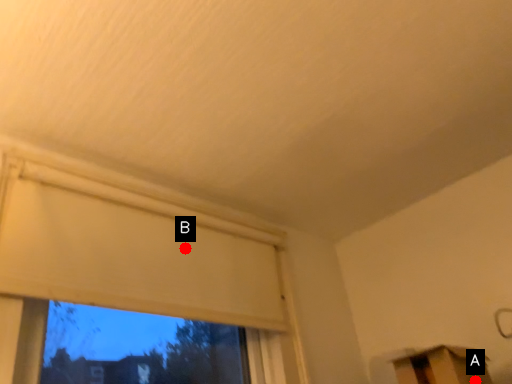
Question: Two points are circled on the image, labeled by A and B beside each circle. Among these points, which one is farthest from the camera?

Choices:
 (A) A is further
 (B) B is further

Answer: (B)